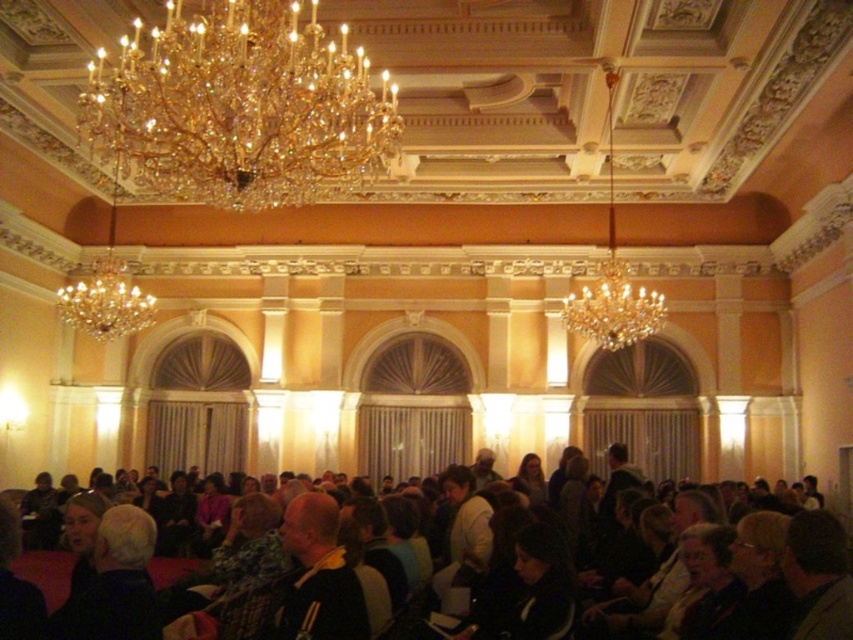
Question: Can you confirm if gold crystal chandelier at upper center is smaller than dark brown hair at lower right?

Choices:
 (A) yes
 (B) no

Answer: (B)

Question: Estimate the real-world distances between objects in this image. Which object is closer to the crystal glass chandelier at center?

Choices:
 (A) crystal glass chandelier at upper center
 (B) gold crystal chandelier at upper center
 (C) black fabric jacket at center

Answer: (A)

Question: Does gold crystal chandelier at upper center have a smaller size compared to dark brown hair at center?

Choices:
 (A) yes
 (B) no

Answer: (B)

Question: Is gold crystal chandelier at upper center wider than dark brown hair at center?

Choices:
 (A) no
 (B) yes

Answer: (B)

Question: Estimate the real-world distances between objects in this image. Which object is closer to the crystal glass chandelier at upper left?

Choices:
 (A) dark brown hair at center
 (B) dark brown hair at lower right
 (C) gold crystal chandelier at upper center

Answer: (C)

Question: Which of these objects is positioned farthest from the gold crystal chandelier at upper center?

Choices:
 (A) black fabric jacket at center
 (B) crystal glass chandelier at center

Answer: (B)